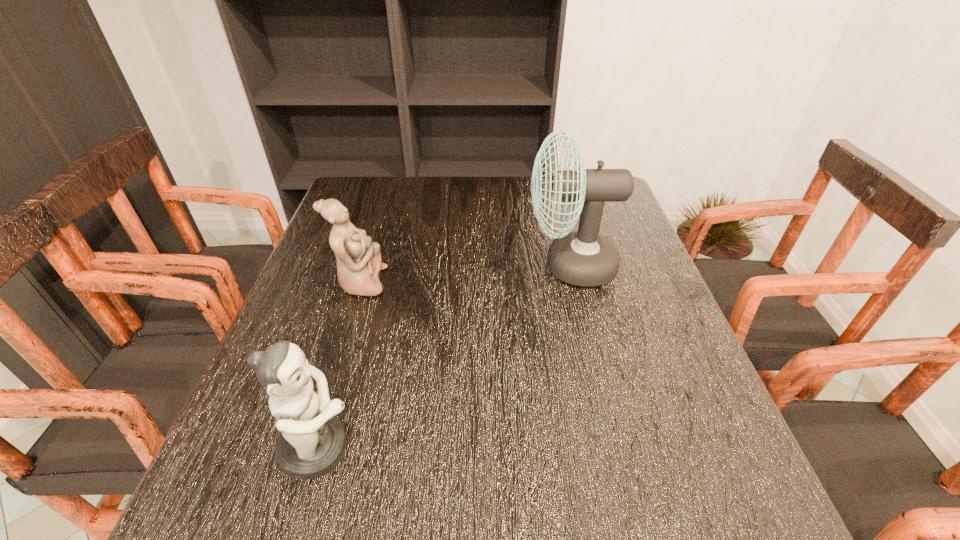
This screenshot has width=960, height=540. I want to click on the tallest object, so click(x=584, y=258).

The image size is (960, 540). What are the coordinates of `the rightmost object` in the screenshot? It's located at (584, 258).

In order to click on the nearest object in this screenshot , I will do coord(312,441).

You are a GUI agent. You are given a task and a screenshot of the screen. Output one action in this format:
    pyautogui.click(x=<x>, y=<y>)
    Task: Click on the farther figurine
    The width and height of the screenshot is (960, 540).
    Given the screenshot: What is the action you would take?
    pyautogui.click(x=359, y=262)

Where is `free space located in front of the fan where the airflow is directed`? This screenshot has height=540, width=960. free space located in front of the fan where the airflow is directed is located at coordinates (461, 266).

Locate an element on the screen. blank space located in front of the fan where the airflow is directed is located at coordinates (449, 266).

Locate an element on the screen. vacant region located in front of the fan where the airflow is directed is located at coordinates (369, 266).

At what (x,y) coordinates should I click in order to perform the action: click on free space located 0.210m on the front-facing side of the nearest object. Please return your answer as a coordinate pair (x, y). The height and width of the screenshot is (540, 960). Looking at the image, I should click on (484, 448).

The width and height of the screenshot is (960, 540). In order to click on free region located on the front-facing side of the farther figurine in this screenshot , I will do `click(529, 282)`.

Where is `object positioned at the right edge`? The width and height of the screenshot is (960, 540). object positioned at the right edge is located at coordinates (584, 258).